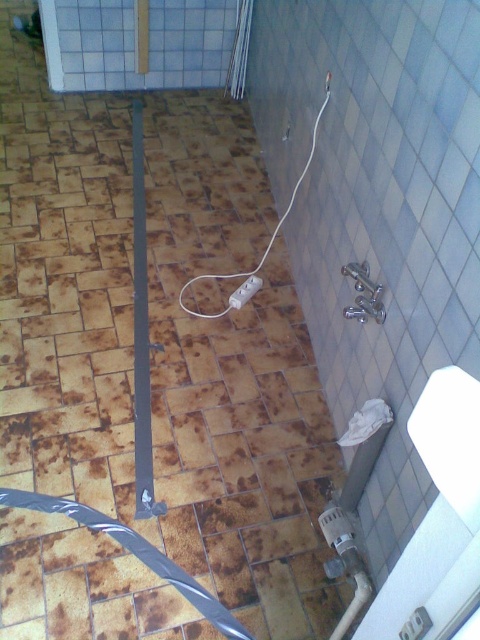
You are standing in a bathroom and need to reach a point that is 1.43 meters away from you. Is the point at coordinates point [384,417] within your reach?

The point at point [384,417] is exactly 1.43 meters away from you, so yes, it is within your reach if you can extend your arm that far.

You are standing in the bathroom and see two points marked on the floor. The first point is at coordinates point (x=358, y=426) and the second is at point (x=252, y=289). Which point is closer to you?

Point (x=358, y=426) is closer to the viewer than point (x=252, y=289).

You are standing in a bathroom and see the white matte toilet paper at lower right and the white plastic plug at center. Which object is closer to the floor?

The white matte toilet paper at lower right is closer to the floor because it is located below the white plastic plug at center.